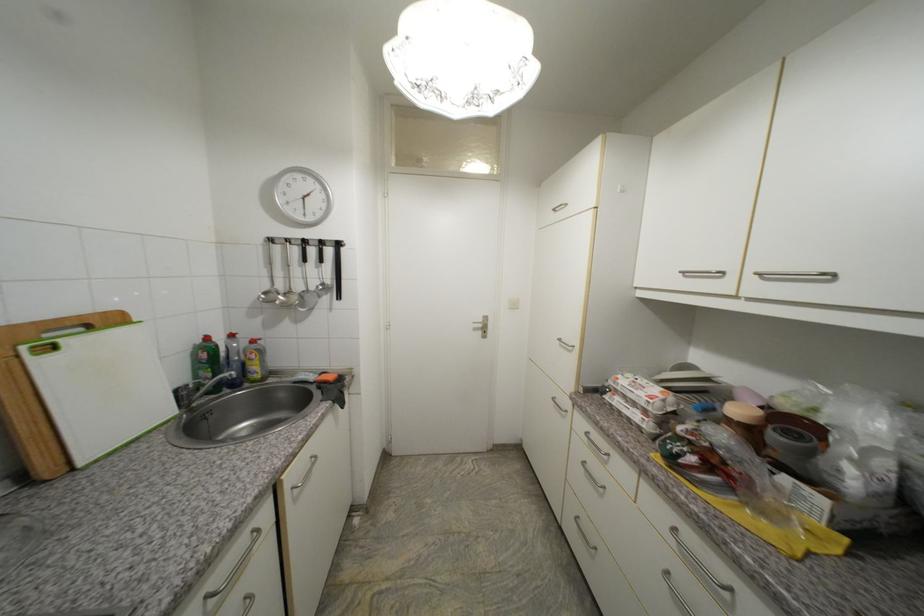
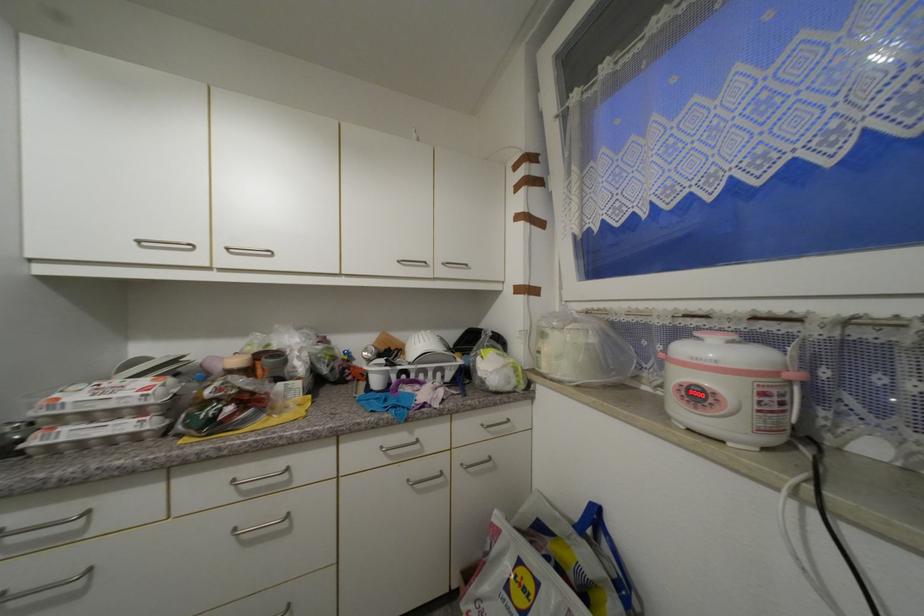
Question: The camera is either moving clockwise (left) or counter-clockwise (right) around the object. The first image is from the beginning of the video and the second image is from the end. Is the camera moving left or right when shooting the video?

Choices:
 (A) Left
 (B) Right

Answer: (A)